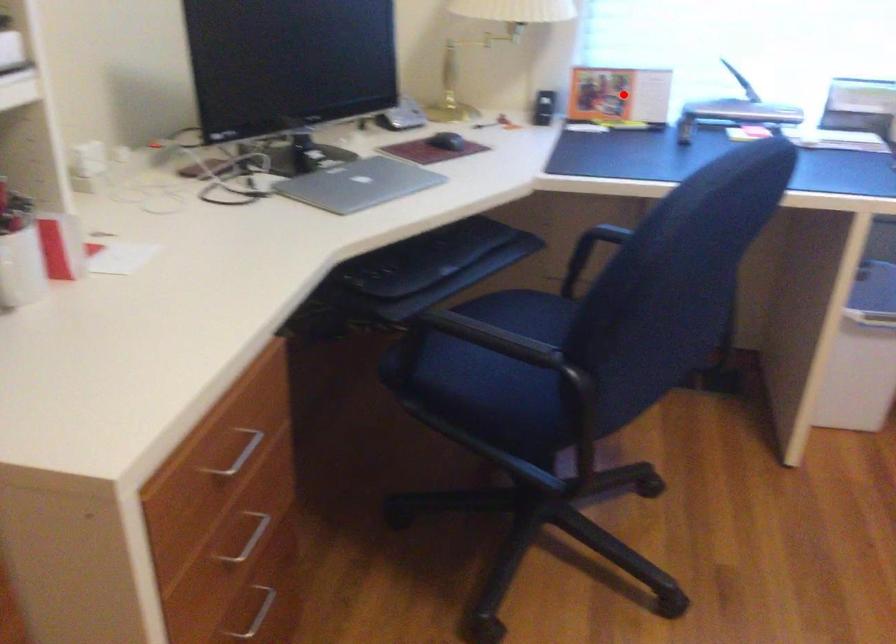
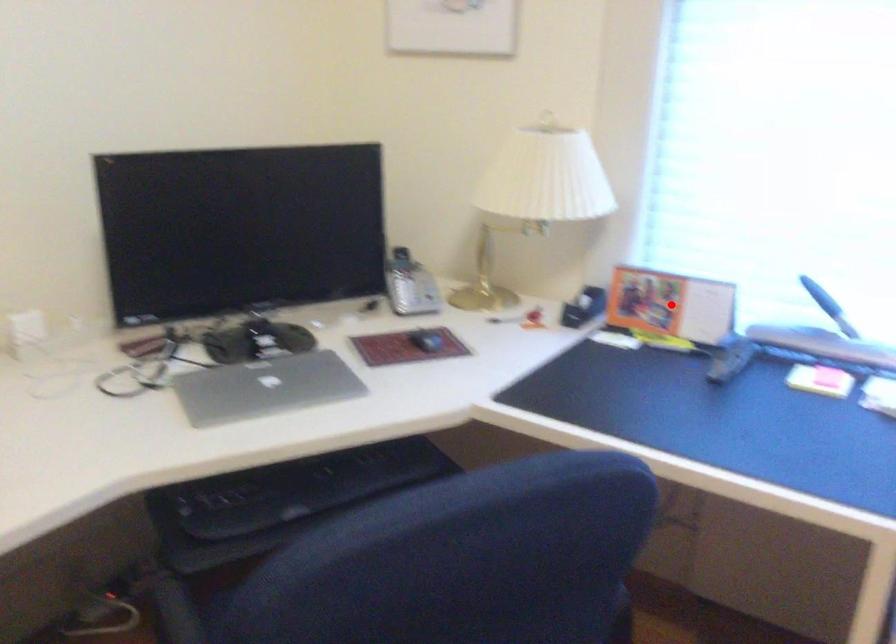
I am providing you with two images of the same scene from different viewpoints. A red point is marked on the first image and another point is marked on the second image. Are the points marked in image1 and image2 representing the same 3D position?

Yes